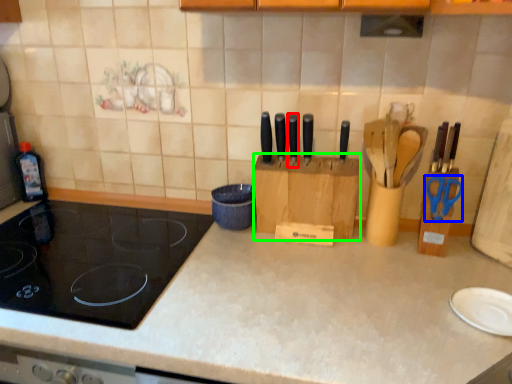
Question: Considering the real-world distances, which object is closest to knife (highlighted by a red box)? scissors (highlighted by a blue box) or cardboard box (highlighted by a green box).

Choices:
 (A) scissors
 (B) cardboard box

Answer: (B)